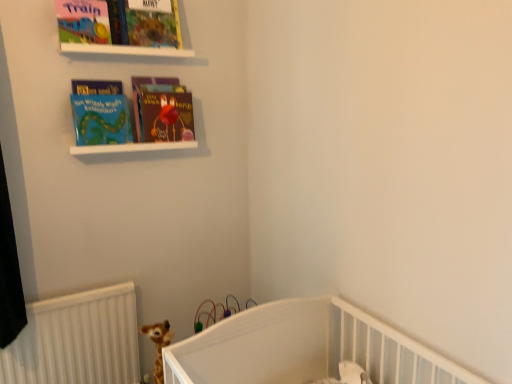
Question: Is matte colorful book at upper center, which is counted as the 1th book cover, starting from the right, not within matte board book at upper left, marked as the 1th book cover in a left-to-right arrangement?

Choices:
 (A) no
 (B) yes

Answer: (B)

Question: Considering the relative sizes of matte colorful book at upper center, marked as the second book cover in a left-to-right arrangement, and matte board book at upper left, marked as the 1th book cover in a left-to-right arrangement, in the image provided, is matte colorful book at upper center, marked as the second book cover in a left-to-right arrangement, smaller than matte board book at upper left, marked as the 1th book cover in a left-to-right arrangement,?

Choices:
 (A) yes
 (B) no

Answer: (B)

Question: From the image's perspective, is matte colorful book at upper center, marked as the second book cover in a left-to-right arrangement, beneath matte board book at upper left, marked as the 1th book cover in a left-to-right arrangement?

Choices:
 (A) no
 (B) yes

Answer: (A)

Question: Does matte colorful book at upper center, marked as the second book cover in a left-to-right arrangement, have a lesser width compared to matte board book at upper left, the 2th book cover in the right-to-left sequence?

Choices:
 (A) yes
 (B) no

Answer: (B)

Question: Is matte colorful book at upper center, which is counted as the 1th book cover, starting from the right, at the right side of matte board book at upper left, marked as the 1th book cover in a left-to-right arrangement?

Choices:
 (A) yes
 (B) no

Answer: (A)

Question: Is matte colorful book at upper center, which is counted as the 1th book cover, starting from the right, facing towards matte board book at upper left, the 2th book cover in the right-to-left sequence?

Choices:
 (A) yes
 (B) no

Answer: (B)

Question: Is matte colorful book at upper center, which is counted as the 1th book cover, starting from the right, positioned beyond the bounds of white matte shelf at upper center?

Choices:
 (A) no
 (B) yes

Answer: (B)

Question: Is matte colorful book at upper center, marked as the second book cover in a left-to-right arrangement, placed right next to white matte shelf at upper center?

Choices:
 (A) no
 (B) yes

Answer: (A)

Question: From a real-world perspective, is matte colorful book at upper center, which is counted as the 1th book cover, starting from the right, on white matte shelf at upper center?

Choices:
 (A) no
 (B) yes

Answer: (B)

Question: Is matte colorful book at upper center, which is counted as the 1th book cover, starting from the right, taller than white matte shelf at upper center?

Choices:
 (A) no
 (B) yes

Answer: (B)

Question: Can you confirm if matte colorful book at upper center, which is counted as the 1th book cover, starting from the right, is smaller than white matte shelf at upper center?

Choices:
 (A) no
 (B) yes

Answer: (A)

Question: Can you confirm if matte colorful book at upper center, marked as the second book cover in a left-to-right arrangement, is shorter than white matte shelf at upper center?

Choices:
 (A) yes
 (B) no

Answer: (B)

Question: Is matte blue book at upper left, which appears as the 2th book when viewed from the right, facing away from white matte shelf at upper center?

Choices:
 (A) no
 (B) yes

Answer: (A)